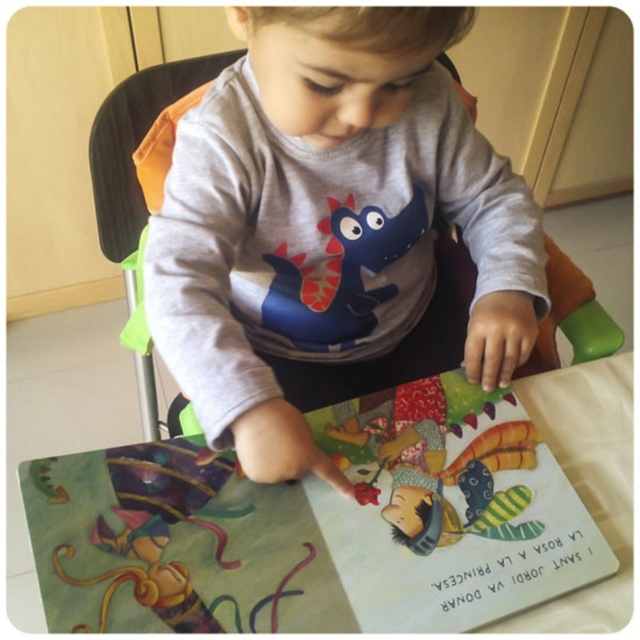
Question: Which of these objects is positioned farthest from the matte paper book at center?

Choices:
 (A) paper book at center
 (B) multicolored quilted book at center

Answer: (A)

Question: Is multicolored quilted book at center thinner than matte paper book at center?

Choices:
 (A) no
 (B) yes

Answer: (A)

Question: Is gray matte shirt at center smaller than multicolored quilted book at center?

Choices:
 (A) no
 (B) yes

Answer: (A)

Question: Among these objects, which one is farthest from the camera?

Choices:
 (A) paper book at center
 (B) gray matte shirt at center
 (C) matte paper book at center

Answer: (C)

Question: Which point is farther from the camera taking this photo?

Choices:
 (A) [321, 518]
 (B) [502, 486]

Answer: (B)

Question: Is gray matte shirt at center wider than multicolored quilted book at center?

Choices:
 (A) yes
 (B) no

Answer: (A)